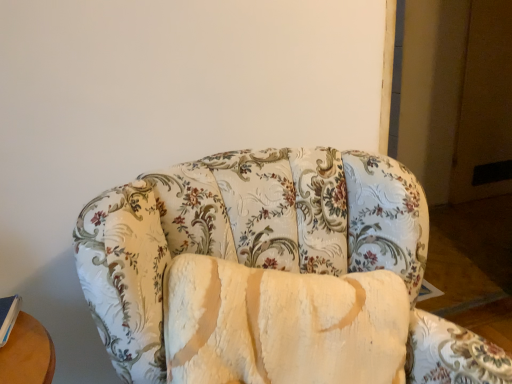
What do you see at coordinates (272, 275) in the screenshot? Image resolution: width=512 pixels, height=384 pixels. I see `floral fabric couch at center` at bounding box center [272, 275].

Where is `floral fabric couch at center`? floral fabric couch at center is located at coordinates (272, 275).

The width and height of the screenshot is (512, 384). What do you see at coordinates (8, 316) in the screenshot? I see `blue hardcover book at lower left` at bounding box center [8, 316].

The width and height of the screenshot is (512, 384). I want to click on blue hardcover book at lower left, so click(x=8, y=316).

Where is `floral fabric couch at center`? The height and width of the screenshot is (384, 512). floral fabric couch at center is located at coordinates (272, 275).

Based on the photo, can you confirm if floral fabric couch at center is positioned to the left of blue hardcover book at lower left?

No, floral fabric couch at center is not to the left of blue hardcover book at lower left.

Which object is further away from the camera taking this photo, floral fabric couch at center or blue hardcover book at lower left?

blue hardcover book at lower left.

Is point (121, 251) farther from camera compared to point (0, 302)?

No.

From the image's perspective, would you say floral fabric couch at center is shown under blue hardcover book at lower left?

Yes, from the image's perspective, floral fabric couch at center is below blue hardcover book at lower left.

From a real-world perspective, does floral fabric couch at center stand above blue hardcover book at lower left?

No, from a real-world perspective, floral fabric couch at center is not on top of blue hardcover book at lower left.

Which of these two, floral fabric couch at center or blue hardcover book at lower left, is wider?

With larger width is floral fabric couch at center.

Is floral fabric couch at center taller or shorter than blue hardcover book at lower left?

In the image, floral fabric couch at center appears to be taller than blue hardcover book at lower left.

Considering the relative sizes of floral fabric couch at center and blue hardcover book at lower left in the image provided, is floral fabric couch at center smaller than blue hardcover book at lower left?

No.

Is floral fabric couch at center surrounding blue hardcover book at lower left?

Actually, blue hardcover book at lower left is outside floral fabric couch at center.

Are floral fabric couch at center and blue hardcover book at lower left far apart?

No, floral fabric couch at center is not far away from blue hardcover book at lower left.

Is floral fabric couch at center oriented towards blue hardcover book at lower left?

No, floral fabric couch at center is not oriented towards blue hardcover book at lower left.

What's the angular difference between floral fabric couch at center and blue hardcover book at lower left's facing directions?

They differ by 4.6 degrees in their facing directions.

How distant is floral fabric couch at center from blue hardcover book at lower left?

The distance of floral fabric couch at center from blue hardcover book at lower left is 55.23 centimeters.

The height and width of the screenshot is (384, 512). In order to click on book behind the floral fabric couch at center in this screenshot , I will do `click(8, 316)`.

Between blue hardcover book at lower left and floral fabric couch at center, which one appears on the left side from the viewer's perspective?

From the viewer's perspective, blue hardcover book at lower left appears more on the left side.

Between blue hardcover book at lower left and floral fabric couch at center, which one is positioned in front?

floral fabric couch at center is more forward.

Considering the positions of point (16, 307) and point (228, 160), is point (16, 307) closer or farther from the camera than point (228, 160)?

Point (16, 307) appears to be closer to the viewer than point (228, 160).

From the image's perspective, is blue hardcover book at lower left above or below floral fabric couch at center?

From the image's perspective, blue hardcover book at lower left appears above floral fabric couch at center.

From a real-world perspective, does blue hardcover book at lower left sit lower than floral fabric couch at center?

No.

Is blue hardcover book at lower left wider or thinner than floral fabric couch at center?

blue hardcover book at lower left is thinner than floral fabric couch at center.

Considering the sizes of objects blue hardcover book at lower left and floral fabric couch at center in the image provided, who is shorter, blue hardcover book at lower left or floral fabric couch at center?

With less height is blue hardcover book at lower left.

Between blue hardcover book at lower left and floral fabric couch at center, which one has larger size?

Bigger between the two is floral fabric couch at center.

Could floral fabric couch at center be considered to be inside blue hardcover book at lower left?

No, floral fabric couch at center is not inside blue hardcover book at lower left.

In the scene shown: Is blue hardcover book at lower left placed right next to floral fabric couch at center?

No, blue hardcover book at lower left is not touching floral fabric couch at center.

Is blue hardcover book at lower left turned away from floral fabric couch at center?

No, blue hardcover book at lower left is not facing away from floral fabric couch at center.

You are a GUI agent. You are given a task and a screenshot of the screen. Output one action in this format:
    pyautogui.click(x=<x>, y=<y>)
    Task: Click on the studio couch lying in front of the blue hardcover book at lower left
    The height and width of the screenshot is (384, 512).
    Given the screenshot: What is the action you would take?
    pyautogui.click(x=272, y=275)

Identify the location of book to the left of floral fabric couch at center. The width and height of the screenshot is (512, 384). (8, 316).

You are a GUI agent. You are given a task and a screenshot of the screen. Output one action in this format:
    pyautogui.click(x=<x>, y=<y>)
    Task: Click on the book above the floral fabric couch at center (from a real-world perspective)
    
    Given the screenshot: What is the action you would take?
    (x=8, y=316)